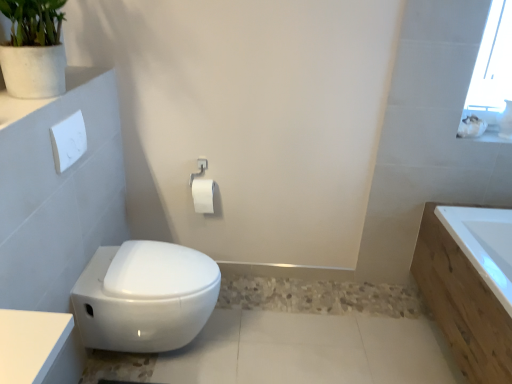
Image resolution: width=512 pixels, height=384 pixels. Identify the location of vacant area situated below white glossy bidet at lower left (from a real-world perspective). (166, 359).